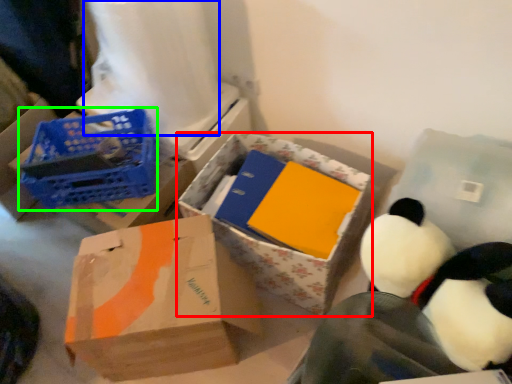
Question: Which object is positioned farthest from box (highlighted by a red box)? Select from toilet paper (highlighted by a blue box) and basket (highlighted by a green box).

Choices:
 (A) toilet paper
 (B) basket

Answer: (A)